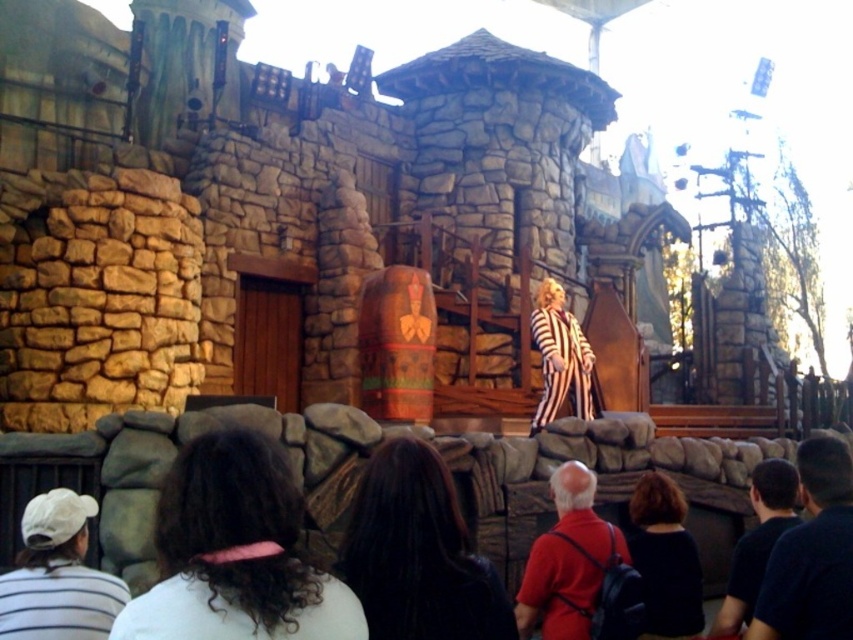
Question: Which object is positioned closest to the dark blue shirt at lower right?

Choices:
 (A) matte red shirt at center
 (B) dark blue t-shirt at lower right

Answer: (B)

Question: Does white cotton cap at lower left have a smaller size compared to dark blue shirt at lower right?

Choices:
 (A) no
 (B) yes

Answer: (B)

Question: Does white cotton cap at lower left have a larger size compared to matte red shirt at center?

Choices:
 (A) yes
 (B) no

Answer: (B)

Question: Observing the image, what is the correct spatial positioning of dark blue t-shirt at lower right in reference to dark blue shirt at lower right?

Choices:
 (A) above
 (B) below

Answer: (A)

Question: Which object is positioned closest to the dark blue t-shirt at lower right?

Choices:
 (A) matte red shirt at center
 (B) white cotton cap at lower left
 (C) dark blue shirt at lower right

Answer: (C)

Question: Which object is positioned closest to the white cotton cap at lower left?

Choices:
 (A) matte red shirt at center
 (B) dark blue t-shirt at lower right
 (C) dark blue shirt at lower right

Answer: (A)